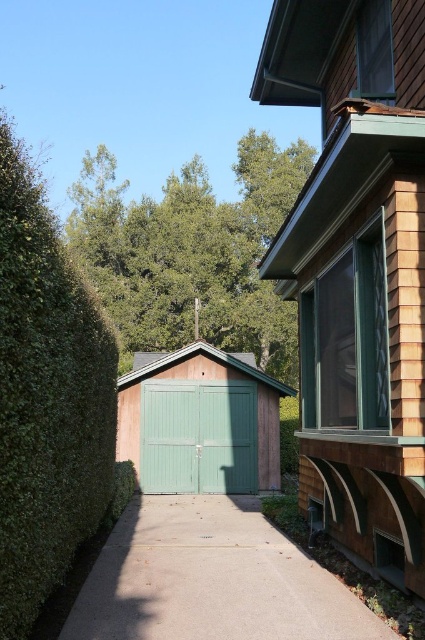
Consider the image. Can you confirm if green woodshed at center is shorter than green leafy hedge at left?

In fact, green woodshed at center may be taller than green leafy hedge at left.

Can you confirm if green woodshed at center is taller than green leafy hedge at left?

Correct, green woodshed at center is much taller as green leafy hedge at left.

Describe the element at coordinates (357, 269) in the screenshot. I see `green woodshed at center` at that location.

Identify the location of green woodshed at center. The image size is (425, 640). point(357,269).

Is green textured shed at center wider than smooth concrete driveway at center?

Correct, the width of green textured shed at center exceeds that of smooth concrete driveway at center.

Is green textured shed at center positioned in front of smooth concrete driveway at center?

No, green textured shed at center is behind smooth concrete driveway at center.

Locate an element on the screen. green textured shed at center is located at coordinates (192, 252).

You are a GUI agent. You are given a task and a screenshot of the screen. Output one action in this format:
    pyautogui.click(x=<x>, y=<y>)
    Task: Click on the smooth concrete driveway at center
    The width and height of the screenshot is (425, 640).
    Given the screenshot: What is the action you would take?
    pyautogui.click(x=212, y=579)

Identify the location of smooth concrete driveway at center. This screenshot has width=425, height=640. (212, 579).